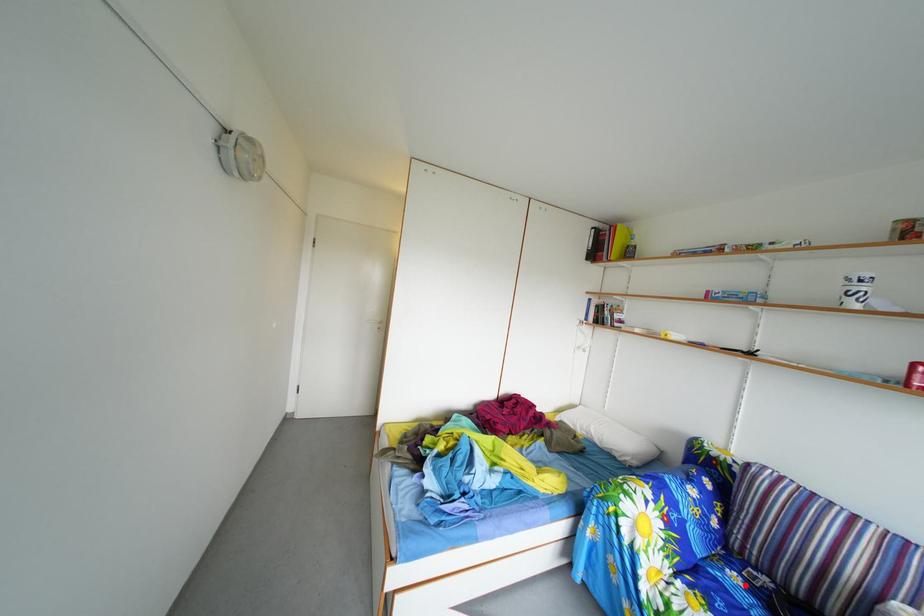
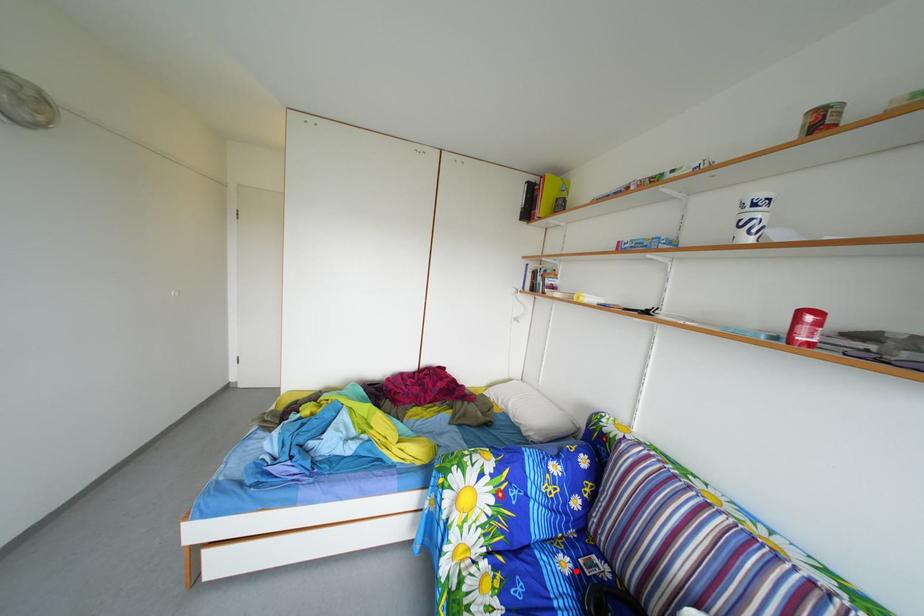
I am providing you with two images of the same scene from different viewpoints. A red point is marked on the first image and another point is marked on the second image. Do the highlighted points in image1 and image2 indicate the same real-world spot?

Yes